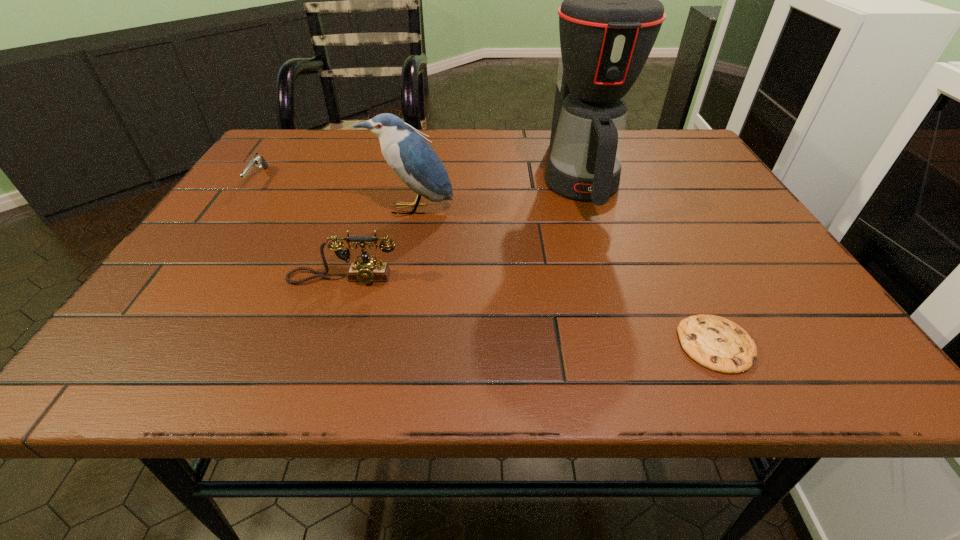
The image size is (960, 540). I want to click on vacant space that satisfies the following two spatial constraints: 1. on the front-facing side of the cookie; 2. on the left side of the leftmost object, so click(142, 345).